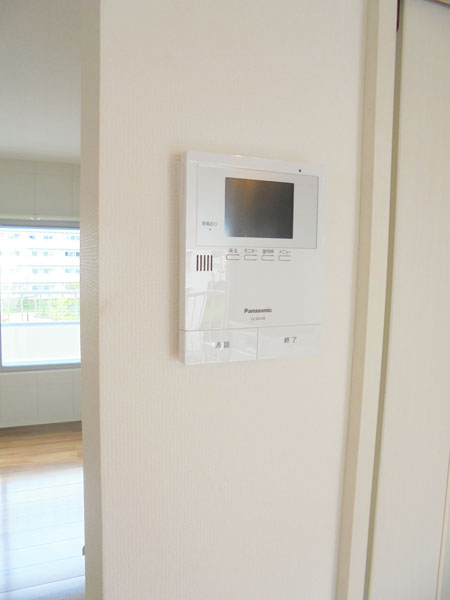
I want to click on wood floor, so tap(40, 443).